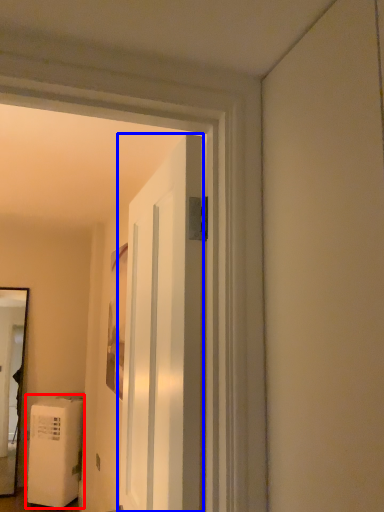
Question: Which of the following is the farthest to the observer, water heater (highlighted by a red box) or door (highlighted by a blue box)?

Choices:
 (A) water heater
 (B) door

Answer: (A)